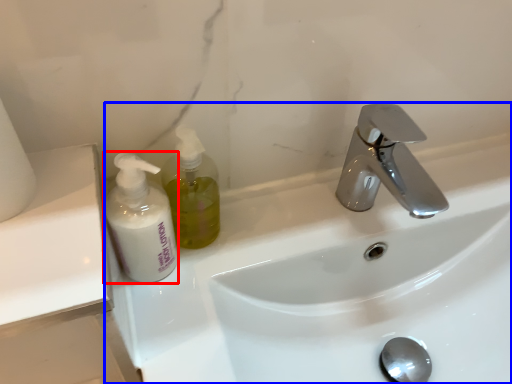
Question: Which of the following is the farthest to the observer, cleaning product (highlighted by a red box) or sink (highlighted by a blue box)?

Choices:
 (A) cleaning product
 (B) sink

Answer: (A)